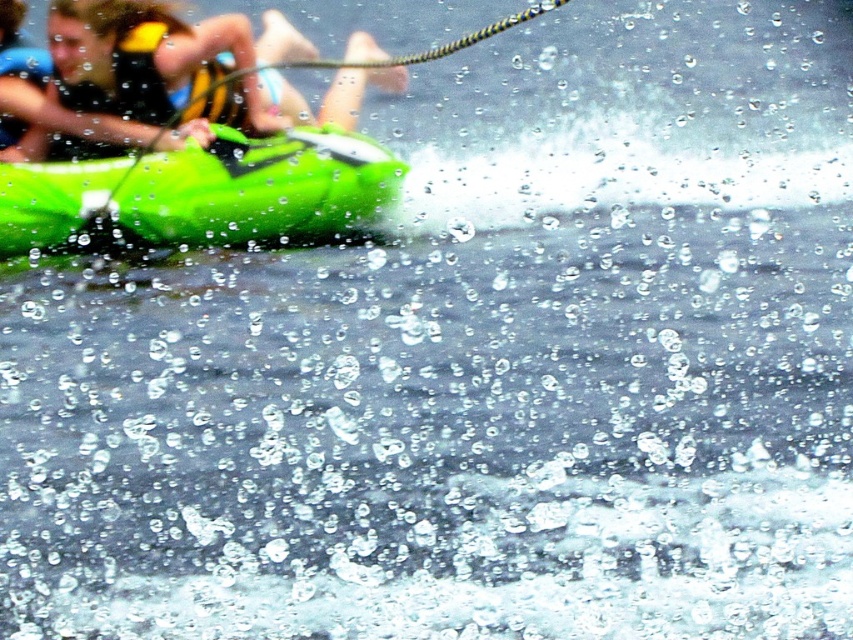
Question: Which object is closer to the camera taking this photo?

Choices:
 (A) green matte kayak at left
 (B) yellow life vest at upper left

Answer: (A)

Question: Can you confirm if green matte kayak at left is positioned above yellow life vest at upper left?

Choices:
 (A) no
 (B) yes

Answer: (A)

Question: From the image, what is the correct spatial relationship of green matte kayak at left in relation to yellow life vest at upper left?

Choices:
 (A) below
 (B) above

Answer: (A)

Question: Does green matte kayak at left appear over yellow life vest at upper left?

Choices:
 (A) yes
 (B) no

Answer: (B)

Question: Which point is farther from the camera taking this photo?

Choices:
 (A) (340, 154)
 (B) (264, 118)

Answer: (B)